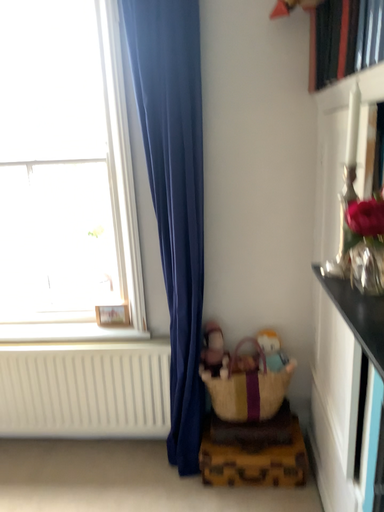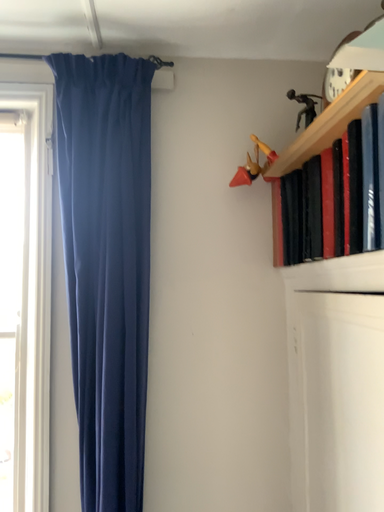
Question: How did the camera likely rotate when shooting the video?

Choices:
 (A) rotated right
 (B) rotated left

Answer: (A)